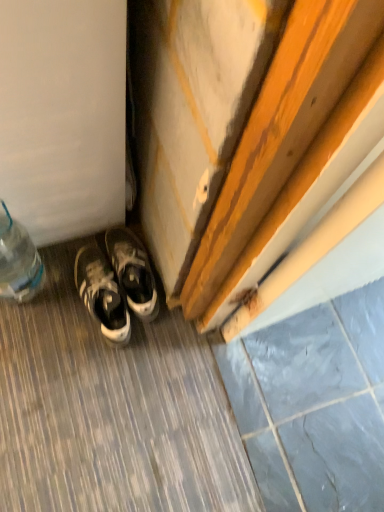
Question: Is gray stone tile at lower right oriented towards white leather sneakers at lower left?

Choices:
 (A) no
 (B) yes

Answer: (A)

Question: Is gray stone tile at lower right closer to the viewer compared to white leather sneakers at lower left?

Choices:
 (A) yes
 (B) no

Answer: (A)

Question: From the image's perspective, is gray stone tile at lower right on white leather sneakers at lower left?

Choices:
 (A) yes
 (B) no

Answer: (B)

Question: Is gray stone tile at lower right turned away from white leather sneakers at lower left?

Choices:
 (A) no
 (B) yes

Answer: (A)

Question: Considering the relative sizes of gray stone tile at lower right and white leather sneakers at lower left in the image provided, is gray stone tile at lower right shorter than white leather sneakers at lower left?

Choices:
 (A) yes
 (B) no

Answer: (A)

Question: Based on their sizes in the image, would you say white leather sneakers at lower left is bigger or smaller than white leather sneakers at lower left?

Choices:
 (A) small
 (B) big

Answer: (B)

Question: From the image's perspective, is white leather sneakers at lower left located above or below white leather sneakers at lower left?

Choices:
 (A) below
 (B) above

Answer: (A)

Question: Does point (97, 249) appear closer or farther from the camera than point (122, 252)?

Choices:
 (A) closer
 (B) farther

Answer: (B)

Question: Which is correct: white leather sneakers at lower left is inside white leather sneakers at lower left, or outside of it?

Choices:
 (A) outside
 (B) inside

Answer: (A)

Question: Does point (127, 240) appear closer or farther from the camera than point (8, 219)?

Choices:
 (A) farther
 (B) closer

Answer: (A)

Question: Based on their positions, is white leather sneakers at lower left located to the left or right of clear plastic bottle at lower left?

Choices:
 (A) right
 (B) left

Answer: (A)

Question: Is white leather sneakers at lower left in front of or behind clear plastic bottle at lower left in the image?

Choices:
 (A) front
 (B) behind

Answer: (B)

Question: From the image's perspective, is white leather sneakers at lower left positioned above or below clear plastic bottle at lower left?

Choices:
 (A) above
 (B) below

Answer: (B)

Question: In the image, is white leather sneakers at lower left on the left side or the right side of white leather sneakers at lower left?

Choices:
 (A) left
 (B) right

Answer: (B)

Question: Is white leather sneakers at lower left in front of or behind white leather sneakers at lower left in the image?

Choices:
 (A) behind
 (B) front

Answer: (A)